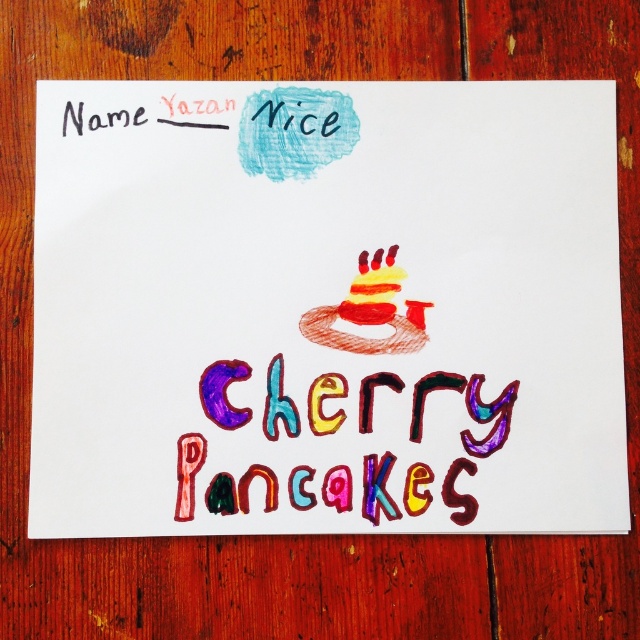
Does point (508, 179) lie behind point (396, 513)?

Yes.

Does point (538, 138) come behind point (483, 442)?

Yes, point (538, 138) is farther from viewer.

At what (x,y) coordinates should I click in order to perform the action: click on colored crayon pancake at center. Please return your answer as a coordinate pair (x, y). Image resolution: width=640 pixels, height=640 pixels. Looking at the image, I should click on (326, 308).